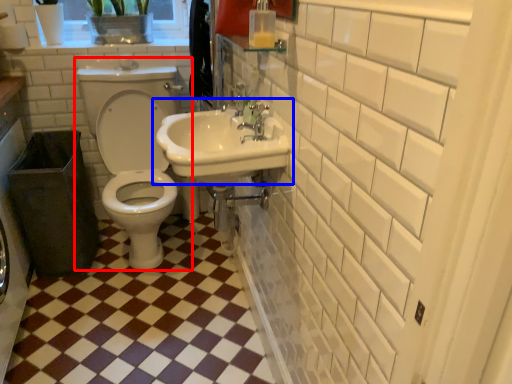
Question: Which object is closer to the camera taking this photo, toilet (highlighted by a red box) or sink (highlighted by a blue box)?

Choices:
 (A) toilet
 (B) sink

Answer: (B)